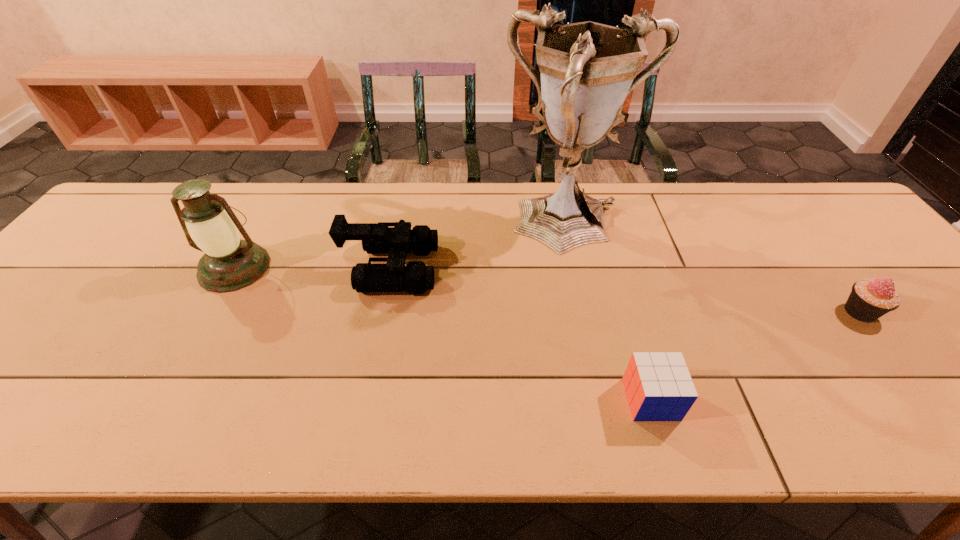
Locate an element on the screen. the tallest object is located at coordinates (588, 69).

Where is `the second tallest object`? Image resolution: width=960 pixels, height=540 pixels. the second tallest object is located at coordinates (229, 263).

Find the location of a particular element. lantern is located at coordinates (229, 263).

Find the location of a particular element. The image size is (960, 540). the third tallest object is located at coordinates (415, 277).

Find the location of a particular element. the fourth object from right to left is located at coordinates (415, 277).

You are a GUI agent. You are given a task and a screenshot of the screen. Output one action in this format:
    pyautogui.click(x=<x>, y=<y>)
    Task: Click on the cupcake
    This screenshot has width=960, height=540.
    Given the screenshot: What is the action you would take?
    pyautogui.click(x=869, y=300)

Find the location of `the rightmost object`. the rightmost object is located at coordinates (869, 300).

In order to click on the nearest object in this screenshot , I will do `click(658, 385)`.

Find the location of a particular element. the shortest object is located at coordinates click(x=658, y=385).

I want to click on vacant space situated 0.250m on the left of the tallest object, so click(x=416, y=226).